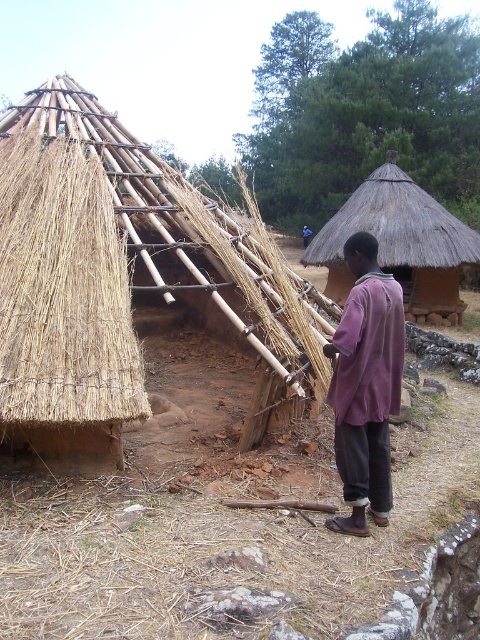
You are standing in front of the partially completed hut and want to take a photo that includes both point A at point (362, 492) and point B at point (387, 200). Which point will appear larger in your photo?

Point A at point (362, 492) will appear larger in the photo because it is closer to the camera than point B at point (387, 200).

Consider the image. You are an architect visiting a rural village and notice the natural straw thatch at upper left and the purple cotton shirt at center. Based on the scene, which object is taller?

The natural straw thatch at upper left is taller than the purple cotton shirt at center.

You are an architect visiting a rural area and see the natural straw thatch at upper left and the purple cotton shirt at center. Which object would you estimate has a larger size based on their positions in the image?

The natural straw thatch at upper left is bigger than the purple cotton shirt at center, so the natural straw thatch at upper left has a larger size.